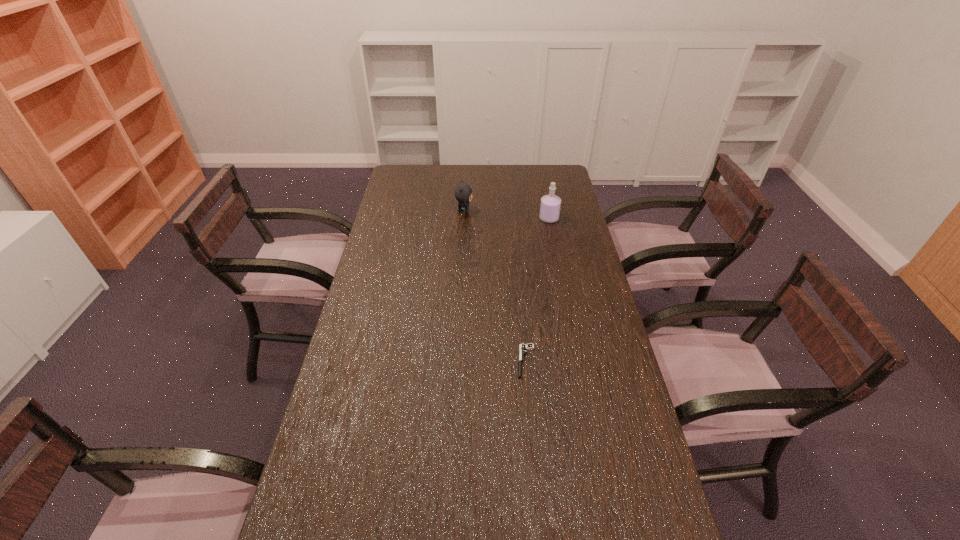
I want to click on perfume, so click(x=550, y=205).

Find the location of `the rightmost object`. the rightmost object is located at coordinates (550, 205).

Locate an element on the screen. the second tallest object is located at coordinates (463, 193).

Where is `the leftmost object`? The width and height of the screenshot is (960, 540). the leftmost object is located at coordinates (463, 193).

At what (x,y) coordinates should I click in order to perform the action: click on pistol. Please return your answer as a coordinate pair (x, y). The width and height of the screenshot is (960, 540). Looking at the image, I should click on (522, 347).

I want to click on the nearest object, so click(x=522, y=347).

Find the location of a particular element. This screenshot has width=960, height=540. vacant space located 0.200m on the left of the rightmost object is located at coordinates (492, 219).

This screenshot has width=960, height=540. What are the coordinates of `blank space located on the front-facing side of the leftmost object` in the screenshot? It's located at (484, 211).

What are the coordinates of `free location located 0.170m on the front-facing side of the second object from right to left` in the screenshot? It's located at (460, 361).

The width and height of the screenshot is (960, 540). Identify the location of free space located on the front-facing side of the second object from right to left. (444, 361).